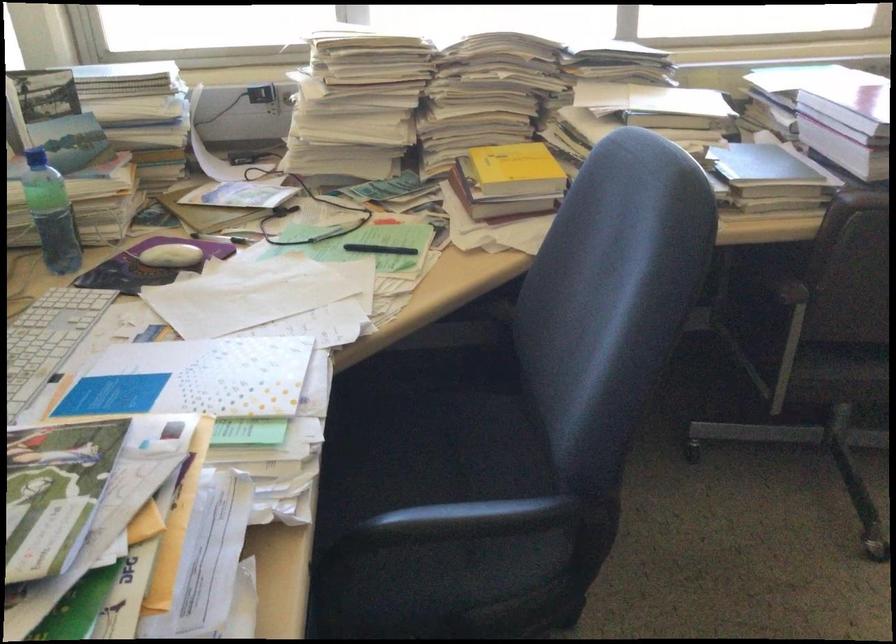
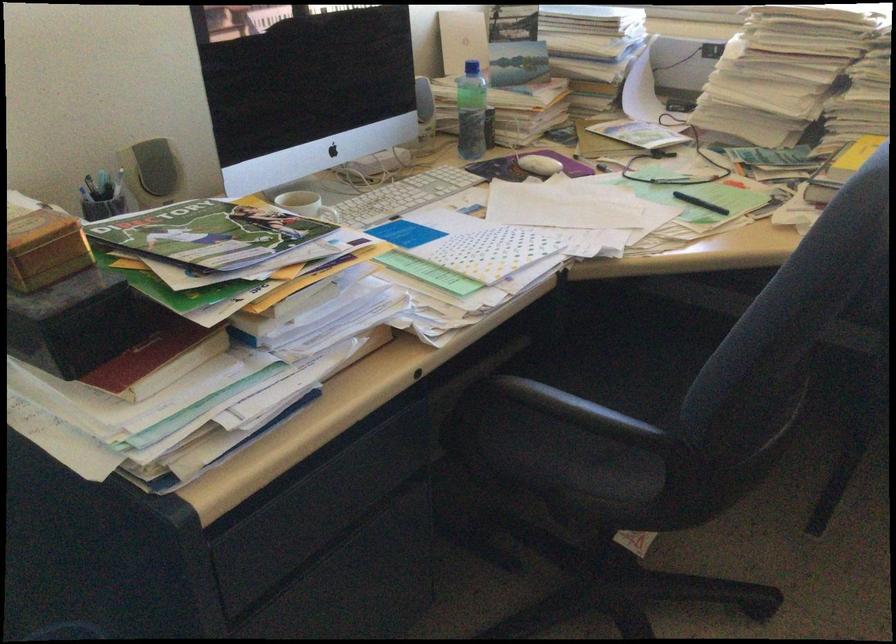
Locate, in the second image, the point that corresponds to pixel 385 449 in the first image.

(618, 365)